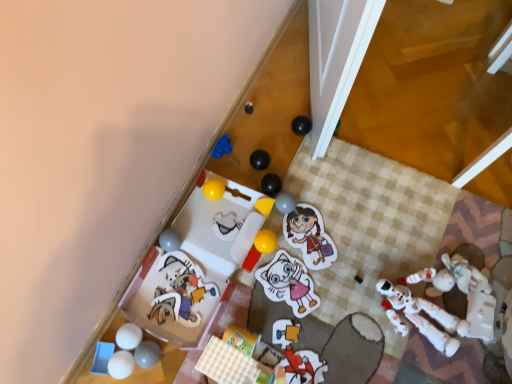
This screenshot has width=512, height=384. What are the coordinates of `vacant space in between white plastic toy at lower right, the fifteenth toy viewed from the left, and rubber matte ball at center, marked as the third toy in a right-to-left arrangement` in the screenshot? It's located at (340, 251).